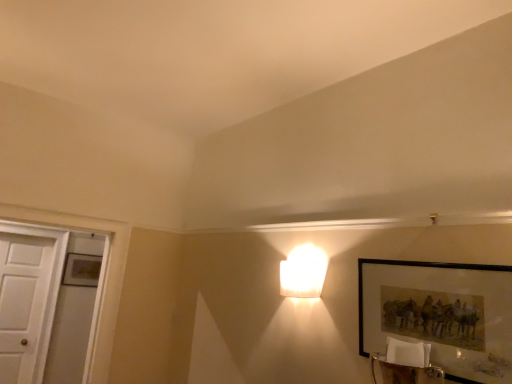
Question: Is matte black picture frame at lower right taller or shorter than white wooden door at left?

Choices:
 (A) tall
 (B) short

Answer: (B)

Question: Visually, is matte black picture frame at lower right positioned to the left or to the right of white wooden door at left?

Choices:
 (A) left
 (B) right

Answer: (B)

Question: Based on their relative distances, which object is nearer to the white wooden door at left?

Choices:
 (A) matte black picture frame at lower right
 (B) white frosted glass lamp at upper center

Answer: (B)

Question: Which is nearer to the white frosted glass lamp at upper center?

Choices:
 (A) matte black picture frame at lower right
 (B) white wooden door at left

Answer: (A)